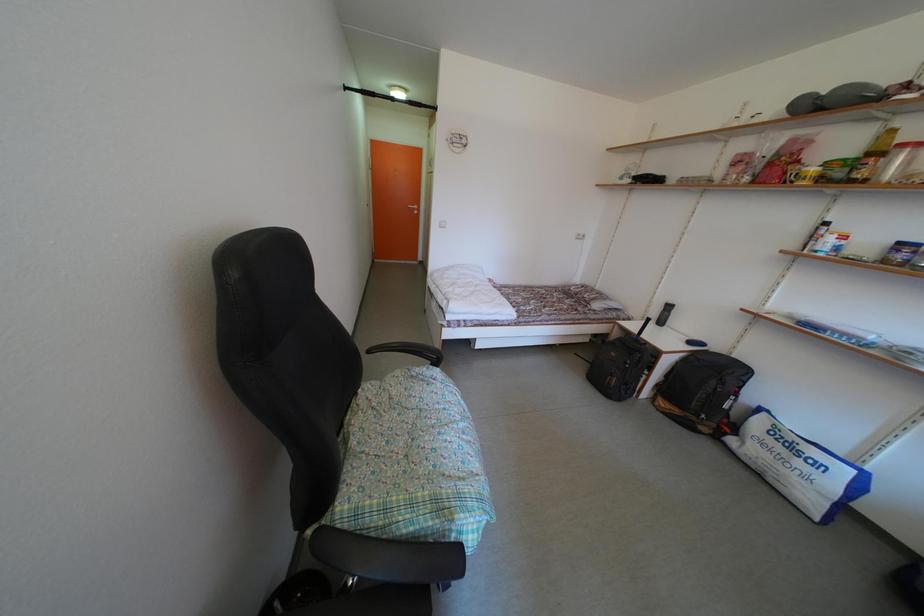
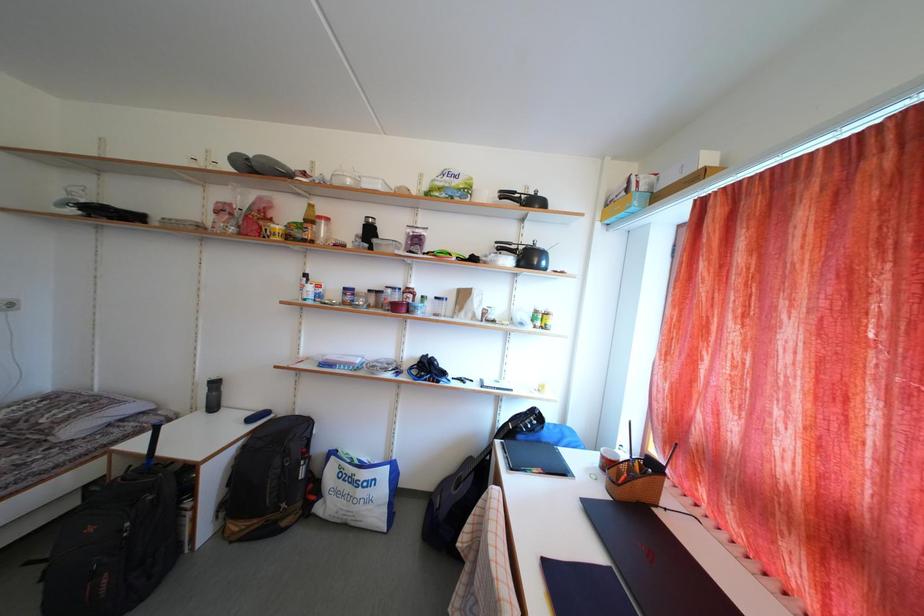
Question: How did the camera likely rotate?

Choices:
 (A) Left
 (B) Right
 (C) Up
 (D) Down

Answer: (B)